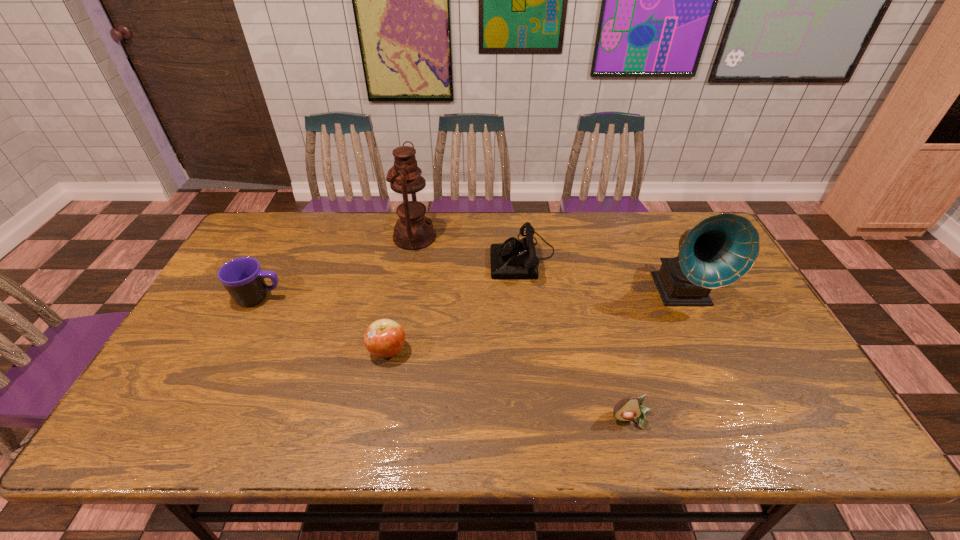
In the image, there is a desktop. Identify the location of free space at the near edge. (247, 416).

This screenshot has width=960, height=540. Identify the location of free space at the left edge of the desktop. (281, 261).

In the image, there is a desktop. Identify the location of blank space at the right edge. The width and height of the screenshot is (960, 540). (726, 309).

Identify the location of vacant space at the far left corner of the desktop. (283, 214).

At what (x,y) coordinates should I click in order to perform the action: click on vacant space at the far right corner of the desktop. Please return your answer as a coordinate pair (x, y). Looking at the image, I should click on (673, 231).

In the image, there is a desktop. Where is `vacant space at the near right corner`? This screenshot has width=960, height=540. vacant space at the near right corner is located at coordinates (788, 418).

Image resolution: width=960 pixels, height=540 pixels. Find the location of `vacant area that lies between the fourth object from left to right and the oil lamp`. vacant area that lies between the fourth object from left to right and the oil lamp is located at coordinates (468, 246).

Identify the location of unoccupied area between the fourth object from left to right and the avocado. The image size is (960, 540). (577, 338).

The width and height of the screenshot is (960, 540). I want to click on vacant space that's between the nearest object and the fifth farthest object, so click(510, 385).

The height and width of the screenshot is (540, 960). I want to click on vacant space in between the second nearest object and the oil lamp, so click(401, 293).